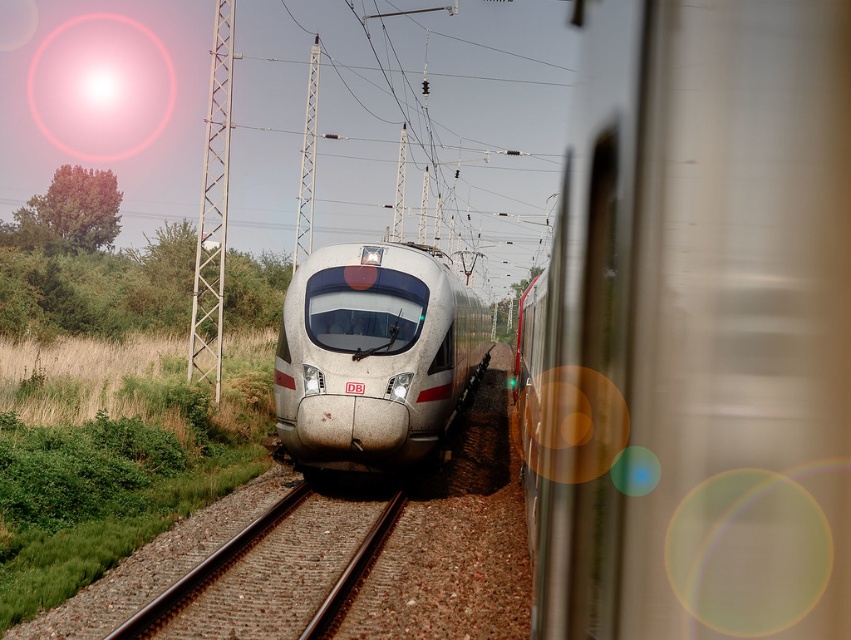
You are a passenger on the metallic train at center and want to look out through the transparent glass train window at center. Can you see the other train approaching from behind through the window?

The metallic train at center is located below the transparent glass train window at center, so the window is above you. Since the other train is behind you, you cannot see it through the window which is positioned above you.

You are a passenger standing at point A, which is located at point (306, 291), and you want to walk to point B, located at point (304, 310). Based on the scene, which direction should you move to reach point B from point A?

Since point A is further to the viewer than point B, you should move forward towards the direction of the moving DB train in the background to reach point B from point A.

You are a maintenance worker who needs to reach the transparent glass train window at center from the silver metallic bullet train at center. Given that your tool kit is 6 feet long, can you safely extend it to reach the window without stepping off the train?

The distance between the silver metallic bullet train at center and the transparent glass train window at center is 5.97 feet. Since the tool kit is 6 feet long, it is just long enough to reach the window without needing to step off the train.